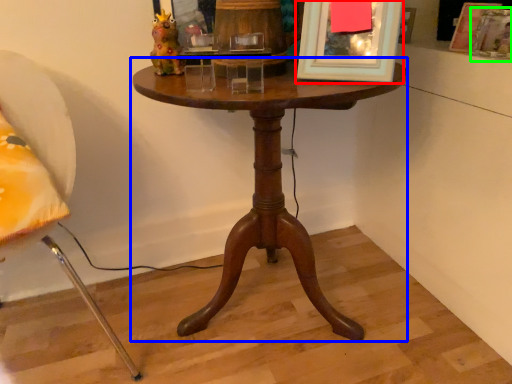
Question: Which object is positioned farthest from picture frame (highlighted by a red box)? Select from table (highlighted by a blue box) and picture frame (highlighted by a green box).

Choices:
 (A) table
 (B) picture frame

Answer: (B)